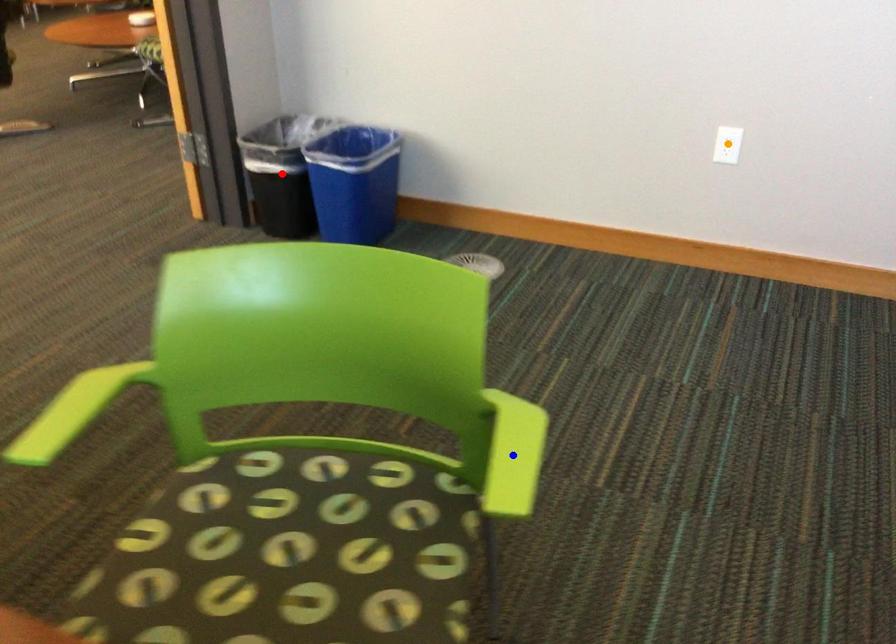
Order these from nearest to farthest:
1. red point
2. orange point
3. blue point

1. blue point
2. orange point
3. red point